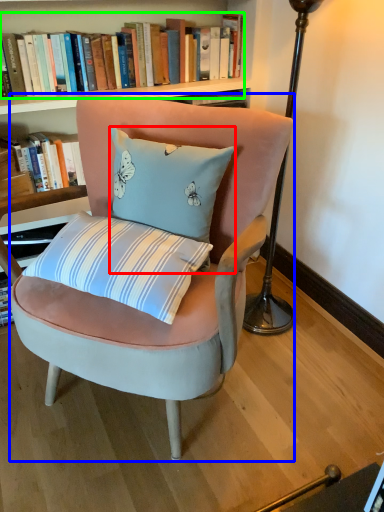
Question: Considering the real-world distances, which object is farthest from pillow (highlighted by a red box)? chair (highlighted by a blue box) or book (highlighted by a green box)?

Choices:
 (A) chair
 (B) book

Answer: (B)